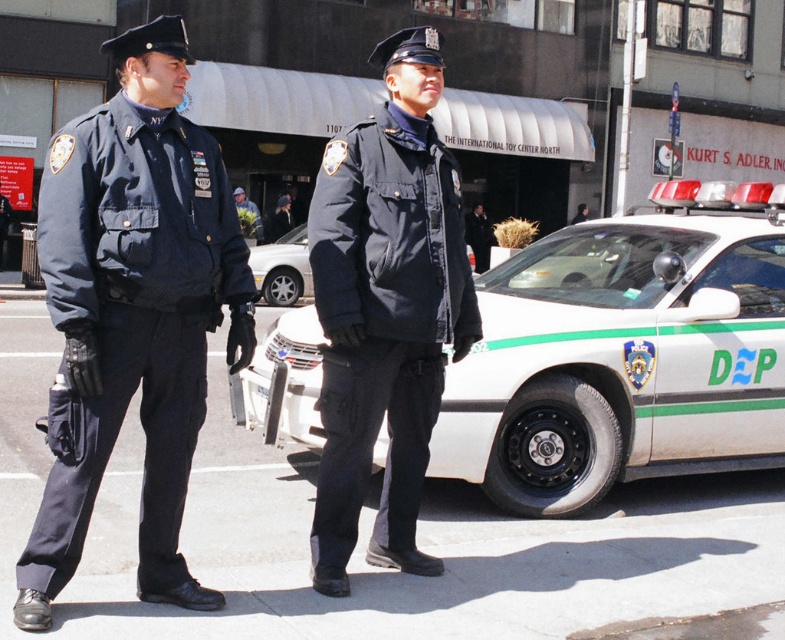
Does point (161, 182) come closer to viewer compared to point (246, 198)?

Yes.

Does navy blue fabric uniform at left appear on the right side of green leafy bouquet at center?

Correct, you'll find navy blue fabric uniform at left to the right of green leafy bouquet at center.

Between point (31, 563) and point (256, 209), which one is positioned behind?

The point (256, 209) is more distant.

Where is `navy blue fabric uniform at left`? navy blue fabric uniform at left is located at coordinates tap(130, 321).

Does navy blue fabric uniform at left appear over navy blue fabric uniform at center?

No.

Between navy blue fabric uniform at left and navy blue fabric uniform at center, which one is positioned higher?

navy blue fabric uniform at center is above.

What do you see at coordinates (130, 321) in the screenshot?
I see `navy blue fabric uniform at left` at bounding box center [130, 321].

This screenshot has width=785, height=640. I want to click on navy blue fabric uniform at left, so (x=130, y=321).

Does white glossy police car at center appear on the left side of navy blue fabric uniform at left?

Incorrect, white glossy police car at center is not on the left side of navy blue fabric uniform at left.

This screenshot has width=785, height=640. I want to click on white glossy police car at center, so click(619, 362).